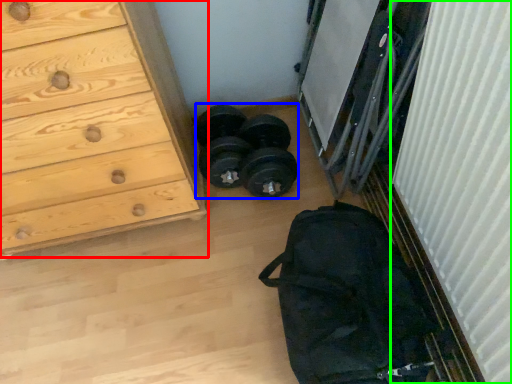
Question: Which object is positioned farthest from chest of drawers (highlighted by a red box)? Select from reel (highlighted by a blue box) and curtain (highlighted by a green box).

Choices:
 (A) reel
 (B) curtain

Answer: (B)